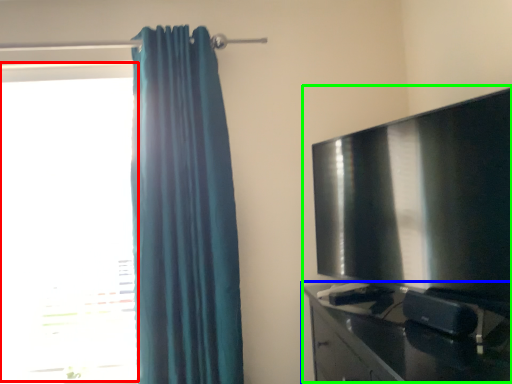
Question: Considering the real-world distances, which object is farthest from window (highlighted by a red box)? furniture (highlighted by a blue box) or entertainment center (highlighted by a green box)?

Choices:
 (A) furniture
 (B) entertainment center

Answer: (B)